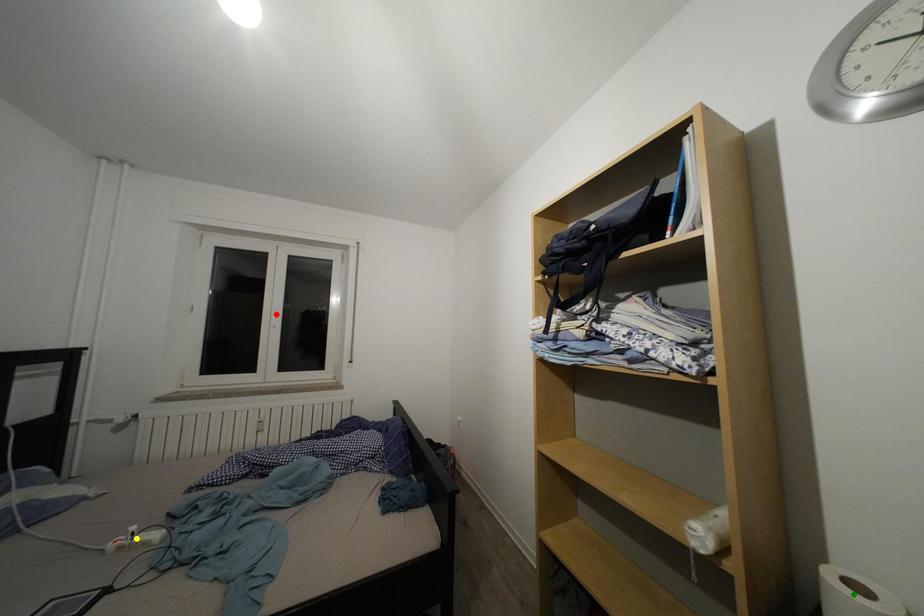
Order these from nearest to farthest:
- red point
- yellow point
- green point

green point
yellow point
red point